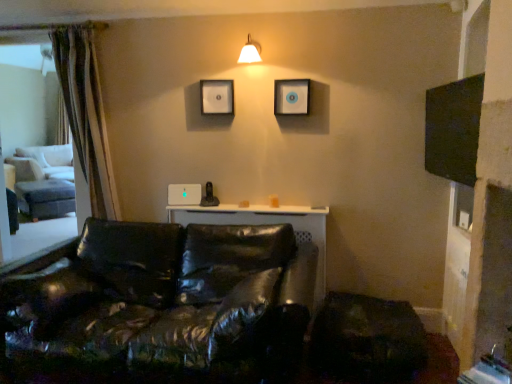
Question: Is matte black picture frame at upper center, placed as the second picture frame when sorted from left to right, smaller than matte black picture frame at upper center, arranged as the 1th picture frame when viewed from the left?

Choices:
 (A) no
 (B) yes

Answer: (A)

Question: Considering the relative positions of matte black picture frame at upper center, placed as the second picture frame when sorted from left to right, and matte black picture frame at upper center, the 2th picture frame positioned from the right, in the image provided, is matte black picture frame at upper center, placed as the second picture frame when sorted from left to right, to the right of matte black picture frame at upper center, the 2th picture frame positioned from the right, from the viewer's perspective?

Choices:
 (A) no
 (B) yes

Answer: (B)

Question: Is matte black picture frame at upper center, placed as the second picture frame when sorted from left to right, wider than matte black picture frame at upper center, the 2th picture frame positioned from the right?

Choices:
 (A) no
 (B) yes

Answer: (B)

Question: Is matte black picture frame at upper center, which is the 1th picture frame in right-to-left order, placed right next to matte black picture frame at upper center, arranged as the 1th picture frame when viewed from the left?

Choices:
 (A) yes
 (B) no

Answer: (B)

Question: From the image's perspective, would you say matte black picture frame at upper center, which is the 1th picture frame in right-to-left order, is shown under matte black picture frame at upper center, arranged as the 1th picture frame when viewed from the left?

Choices:
 (A) no
 (B) yes

Answer: (B)

Question: In terms of width, does matte black picture frame at upper center, arranged as the 1th picture frame when viewed from the left, look wider or thinner when compared to black leather couch at lower left?

Choices:
 (A) thin
 (B) wide

Answer: (A)

Question: From a real-world perspective, relative to black leather couch at lower left, is matte black picture frame at upper center, arranged as the 1th picture frame when viewed from the left, vertically above or below?

Choices:
 (A) above
 (B) below

Answer: (A)

Question: Is point (224, 94) closer or farther from the camera than point (202, 321)?

Choices:
 (A) farther
 (B) closer

Answer: (A)

Question: Is matte black picture frame at upper center, the 2th picture frame positioned from the right, situated inside black leather couch at lower left or outside?

Choices:
 (A) inside
 (B) outside

Answer: (B)

Question: Visually, is matte black picture frame at upper center, which is the 1th picture frame in right-to-left order, positioned to the left or to the right of black matte screen at upper right?

Choices:
 (A) right
 (B) left

Answer: (B)

Question: Considering the positions of matte black picture frame at upper center, which is the 1th picture frame in right-to-left order, and black matte screen at upper right in the image, is matte black picture frame at upper center, which is the 1th picture frame in right-to-left order, taller or shorter than black matte screen at upper right?

Choices:
 (A) short
 (B) tall

Answer: (A)

Question: Considering the positions of point click(290, 94) and point click(471, 180), is point click(290, 94) closer or farther from the camera than point click(471, 180)?

Choices:
 (A) closer
 (B) farther

Answer: (B)

Question: Would you say matte black picture frame at upper center, which is the 1th picture frame in right-to-left order, is inside or outside black matte screen at upper right?

Choices:
 (A) outside
 (B) inside

Answer: (A)

Question: Would you say black matte screen at upper right is to the left or to the right of matte black picture frame at upper center, the 2th picture frame positioned from the right, in the picture?

Choices:
 (A) left
 (B) right

Answer: (B)

Question: Is black matte screen at upper right taller or shorter than matte black picture frame at upper center, the 2th picture frame positioned from the right?

Choices:
 (A) short
 (B) tall

Answer: (B)